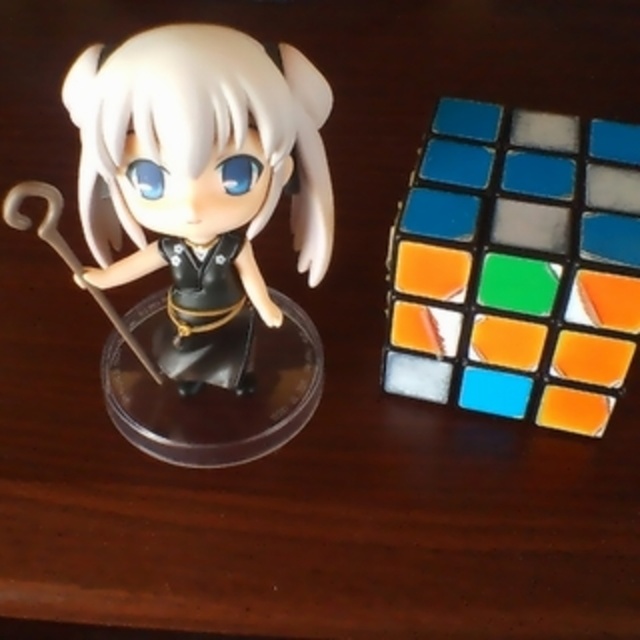
Is rubberized plastic rubik's cube at right shorter than matte gray cube at center right?

No, rubberized plastic rubik's cube at right is not shorter than matte gray cube at center right.

Who is more forward, (400, 244) or (518, 224)?

Positioned in front is point (518, 224).

The width and height of the screenshot is (640, 640). What are the coordinates of `rubberized plastic rubik's cube at right` in the screenshot? It's located at coord(516,266).

This screenshot has height=640, width=640. I want to click on rubberized plastic rubik's cube at right, so click(x=516, y=266).

Is point (632, 196) closer to viewer compared to point (257, 227)?

No, (632, 196) is behind (257, 227).

Who is taller, rubberized plastic rubik's cube at right or satin black figurine at left?

With more height is rubberized plastic rubik's cube at right.

At what (x,y) coordinates should I click in order to perform the action: click on rubberized plastic rubik's cube at right. Please return your answer as a coordinate pair (x, y). The height and width of the screenshot is (640, 640). Looking at the image, I should click on click(x=516, y=266).

Image resolution: width=640 pixels, height=640 pixels. I want to click on rubberized plastic rubik's cube at right, so tap(516, 266).

Is satin black figurine at left thinner than matte gray cube at center right?

No.

Is satin black figurine at left further to camera compared to matte gray cube at center right?

No, it is in front of matte gray cube at center right.

Which is behind, point (144, 264) or point (536, 220)?

The point (144, 264) is more distant.

Find the location of a particular element. satin black figurine at left is located at coordinates (195, 182).